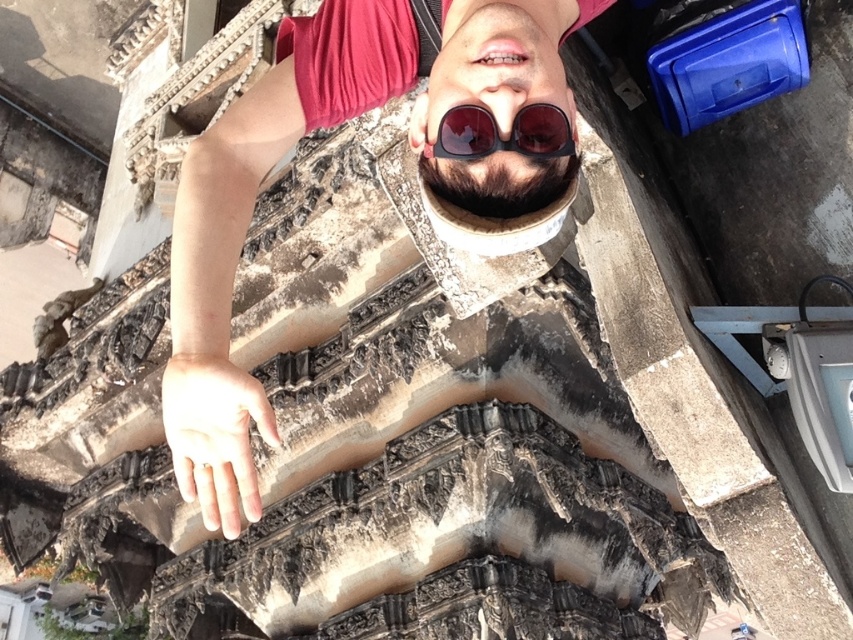
Question: Does matte black sunglasses at center have a smaller size compared to shiny dark sunglasses at center?

Choices:
 (A) no
 (B) yes

Answer: (A)

Question: Which object is closer to the camera taking this photo?

Choices:
 (A) matte black sunglasses at center
 (B) shiny dark sunglasses at center

Answer: (A)

Question: In this image, where is matte black sunglasses at center located relative to shiny dark sunglasses at center?

Choices:
 (A) below
 (B) above

Answer: (B)

Question: Does matte black sunglasses at center have a lesser width compared to shiny dark sunglasses at center?

Choices:
 (A) no
 (B) yes

Answer: (A)